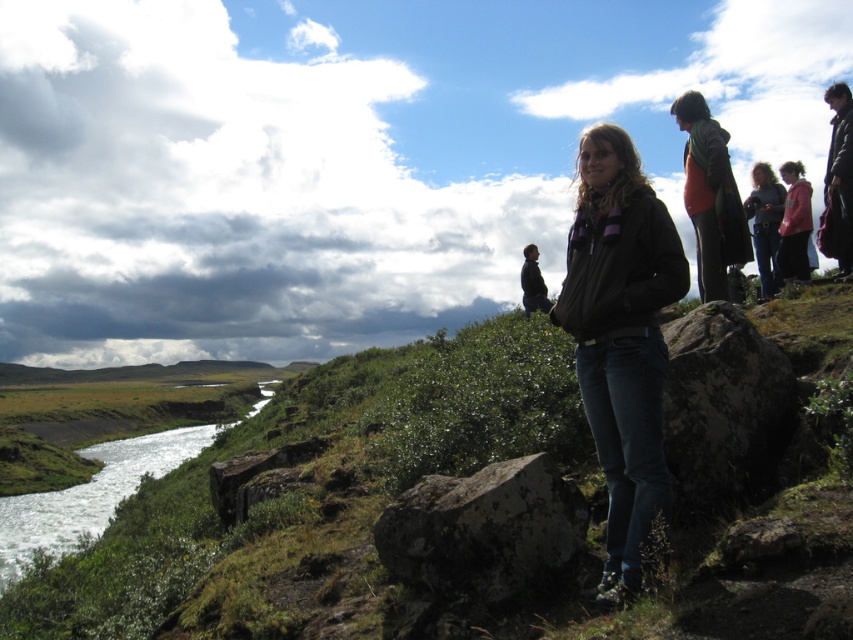
The width and height of the screenshot is (853, 640). What do you see at coordinates (90, 493) in the screenshot?
I see `green grassy creek at lower left` at bounding box center [90, 493].

Does point (96, 518) come behind point (718, 278)?

Yes.

At what (x,y) coordinates should I click in order to perform the action: click on green grassy creek at lower left. Please return your answer as a coordinate pair (x, y). Looking at the image, I should click on (90, 493).

Between point (548, 570) and point (677, 445), which one is positioned behind?

The point (677, 445) is more distant.

I want to click on lichen-covered rock at center, so click(483, 529).

Between point (846, 243) and point (531, 266), which one is positioned behind?

The point (531, 266) is more distant.

Is black fuzzy jacket at upper right further to the viewer compared to dark brown leather jacket at center?

No, it is not.

The width and height of the screenshot is (853, 640). Describe the element at coordinates (840, 163) in the screenshot. I see `black fuzzy jacket at upper right` at that location.

I want to click on black fuzzy jacket at upper right, so click(840, 163).